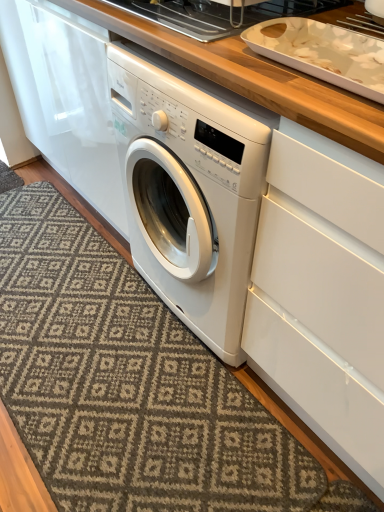
Question: Considering the relative positions of white glossy tray at upper center and patterned carpet at lower left in the image provided, is white glossy tray at upper center to the left or to the right of patterned carpet at lower left?

Choices:
 (A) right
 (B) left

Answer: (A)

Question: From the image's perspective, is white glossy tray at upper center located above or below patterned carpet at lower left?

Choices:
 (A) above
 (B) below

Answer: (A)

Question: Which is nearer to the white glossy tray at upper center?

Choices:
 (A) white glossy tray at upper right
 (B) patterned carpet at lower left

Answer: (A)

Question: Estimate the real-world distances between objects in this image. Which object is closer to the white glossy tray at upper right?

Choices:
 (A) white glossy tray at upper center
 (B) patterned carpet at lower left

Answer: (A)